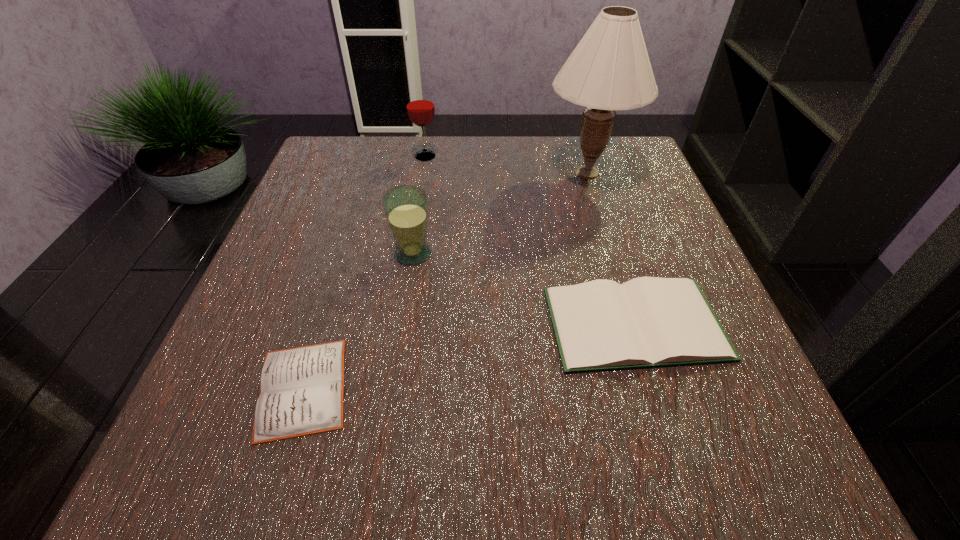
Identify the location of the tallest object. (609, 70).

The width and height of the screenshot is (960, 540). I want to click on the farther glass, so click(420, 107).

You are a GUI agent. You are given a task and a screenshot of the screen. Output one action in this format:
    pyautogui.click(x=<x>, y=<y>)
    Task: Click on the taller glass
    The width and height of the screenshot is (960, 540).
    Given the screenshot: What is the action you would take?
    pyautogui.click(x=420, y=107)

Find the location of a particular element. the shorter glass is located at coordinates (406, 207).

I want to click on the third shortest object, so click(x=406, y=207).

Locate an element on the screen. The height and width of the screenshot is (540, 960). hardback book is located at coordinates (648, 322).

Identify the location of the shortest object. The height and width of the screenshot is (540, 960). (302, 389).

Locate an element on the screen. diary is located at coordinates (302, 389).

You are a GUI agent. You are given a task and a screenshot of the screen. Output one action in this format:
    pyautogui.click(x=<x>, y=<y>)
    Task: Click on the free region located 0.250m on the left of the tallest object
    The width and height of the screenshot is (960, 540).
    Given the screenshot: What is the action you would take?
    pyautogui.click(x=434, y=173)

The image size is (960, 540). Identify the location of vacant space located on the front of the farther glass. (415, 222).